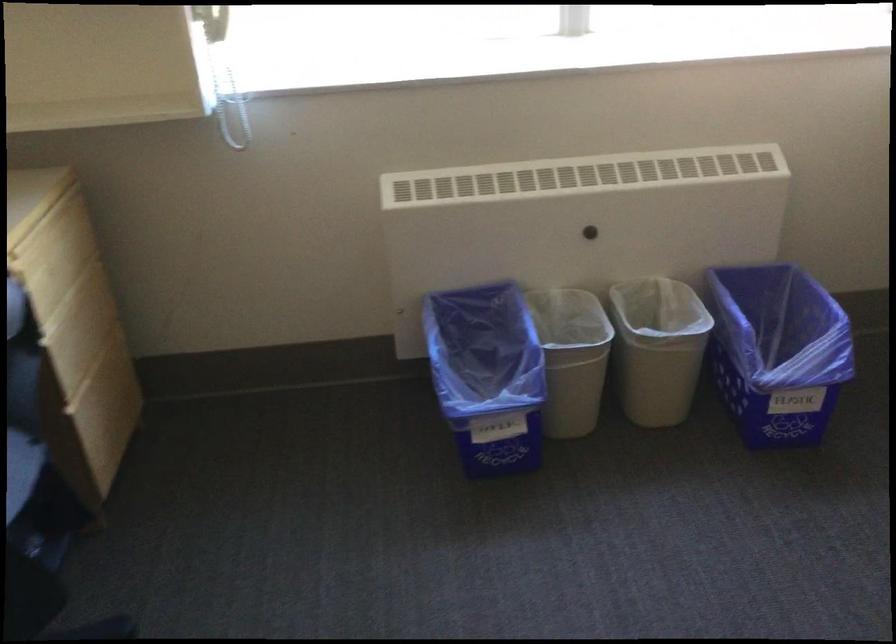
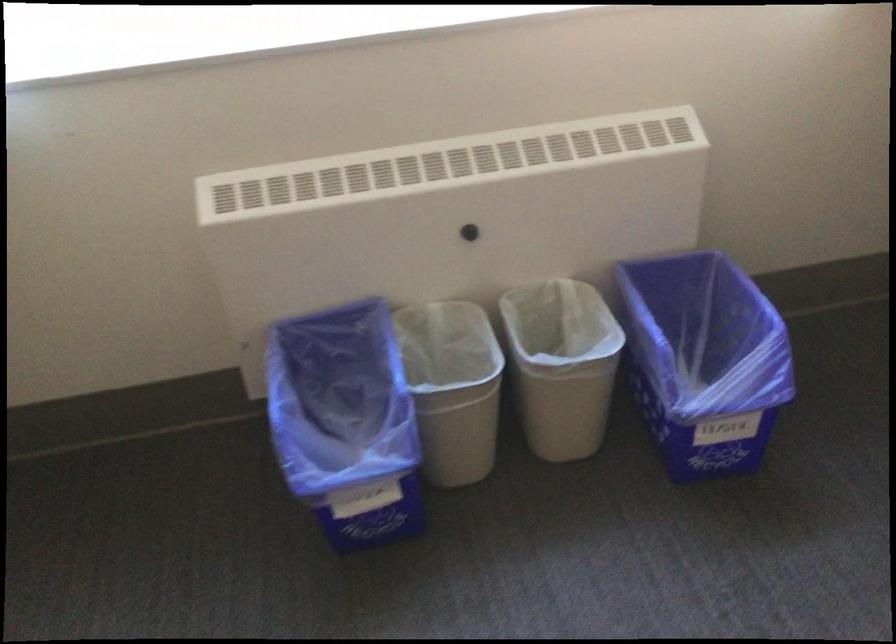
The point at (x=661, y=337) is marked in the first image. Where is the corresponding point in the second image?

(561, 365)